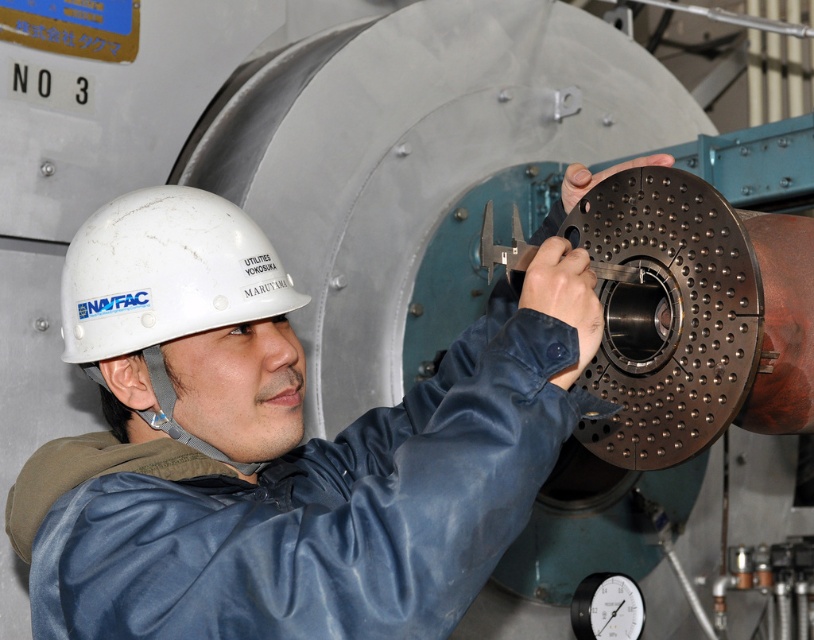
You are an inspector in the industrial area and need to locate the white matte hard hat at upper center and the white matte hard hat at center. According to the scene, which hard hat is positioned to the right of the other?

The white matte hard hat at upper center is positioned on the right side of white matte hard hat at center.

You are a safety inspector in an industrial facility. You need to ensure that the two white matte hard hats are placed at least 5 inches apart for safety regulations. Based on the image provided, are the white matte hard hat at upper center and the white matte hard hat at center compliant with the safety distance requirement?

The distance between the white matte hard hat at upper center and the white matte hard hat at center is 4.76 inches, which is less than the required 5 inches. Therefore, they are not compliant with the safety distance requirement.